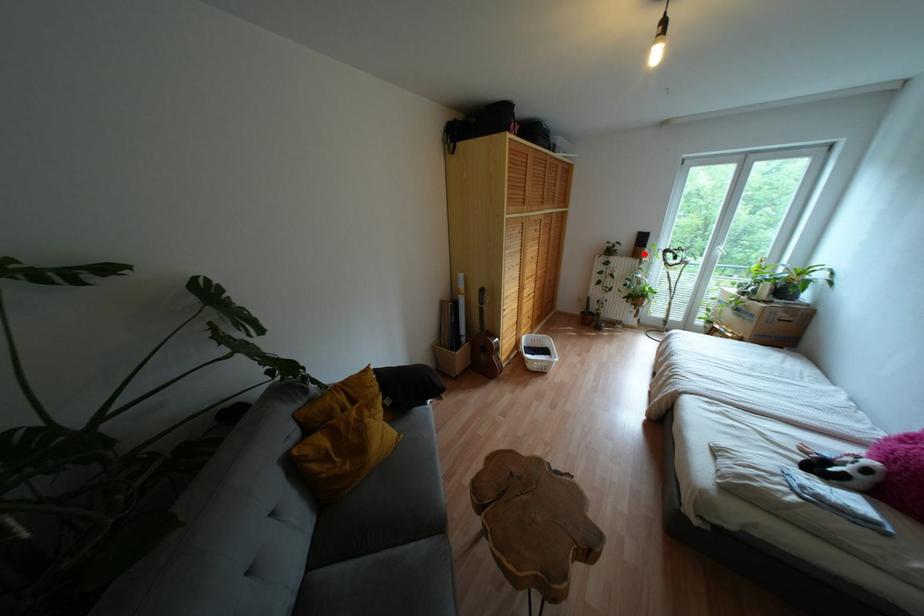
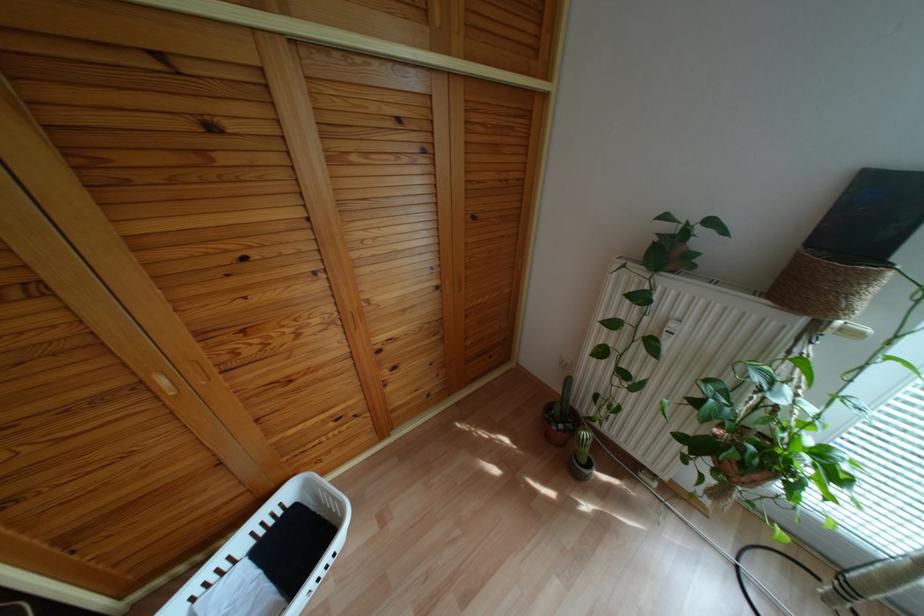
Locate, in the second image, the point that corresponds to the highlighted location in the first image.

(861, 302)